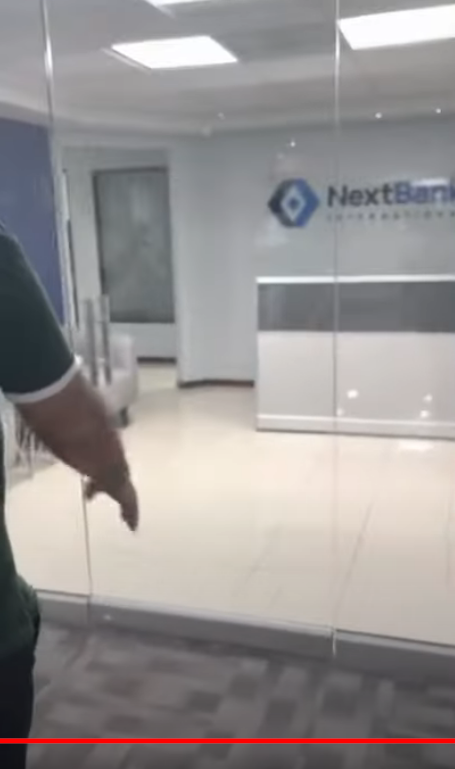
Identify the location of doorway. (135, 231).